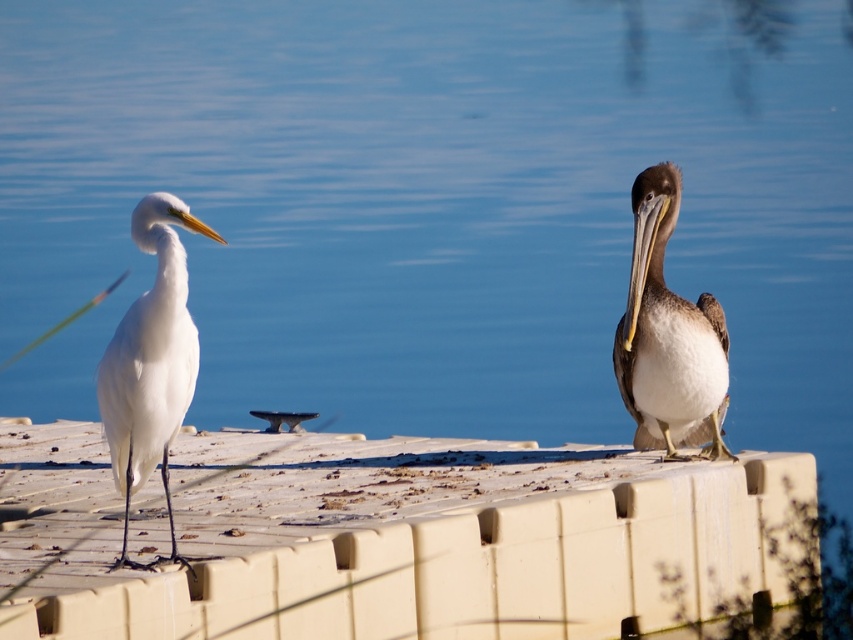
Is brown feathered pelican at right smaller than white matte bird at left?

Yes.

Between brown feathered pelican at right and white matte bird at left, which one appears on the left side from the viewer's perspective?

white matte bird at left is more to the left.

Find the location of `brown feathered pelican at right`. brown feathered pelican at right is located at coordinates (668, 336).

At what (x,y) coordinates should I click in order to perform the action: click on brown feathered pelican at right. Please return your answer as a coordinate pair (x, y). The image size is (853, 640). Looking at the image, I should click on (668, 336).

This screenshot has height=640, width=853. In order to click on white plastic dock at center in this screenshot , I will do `click(392, 538)`.

Looking at this image, is white plastic dock at center positioned in front of brown feathered pelican at right?

That is False.

Is point (68, 604) positioned after point (660, 356)?

No, (68, 604) is closer to viewer.

Locate an element on the screen. The height and width of the screenshot is (640, 853). white plastic dock at center is located at coordinates click(392, 538).

Which is above, white plastic dock at center or white matte bird at left?

Positioned higher is white matte bird at left.

Which of these two, white plastic dock at center or white matte bird at left, stands shorter?

Standing shorter between the two is white plastic dock at center.

Locate an element on the screen. white plastic dock at center is located at coordinates (392, 538).